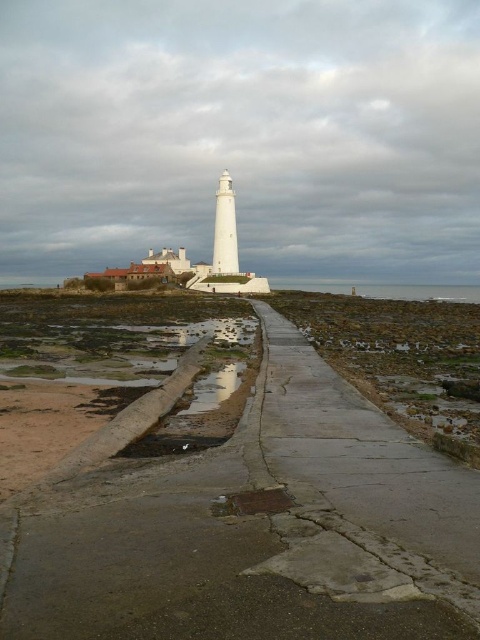
Does concrete at center have a smaller size compared to concrete sidewalk at center?

No.

Which is in front, point (363, 520) or point (470, 502)?

Positioned in front is point (363, 520).

Describe the element at coordinates (260, 529) in the screenshot. Image resolution: width=480 pixels, height=640 pixels. I see `concrete at center` at that location.

Image resolution: width=480 pixels, height=640 pixels. In order to click on concrete at center in this screenshot , I will do `click(260, 529)`.

Does concrete sidewalk at center have a larger size compared to glossy concrete puddle at lower center?

Yes, concrete sidewalk at center is bigger than glossy concrete puddle at lower center.

Measure the distance from concrete sidewalk at center to glossy concrete puddle at lower center.

The distance of concrete sidewalk at center from glossy concrete puddle at lower center is 10.29 meters.

Is point (369, 419) positioned after point (216, 378)?

No, it is in front of (216, 378).

Locate an element on the screen. The height and width of the screenshot is (640, 480). concrete sidewalk at center is located at coordinates (359, 484).

Does concrete at center have a lesser height compared to glossy concrete puddle at lower center?

No.

Is concrete at center positioned before glossy concrete puddle at lower center?

Yes, concrete at center is in front of glossy concrete puddle at lower center.

At what (x,y) coordinates should I click in order to perform the action: click on concrete at center. Please return your answer as a coordinate pair (x, y). Looking at the image, I should click on (260, 529).